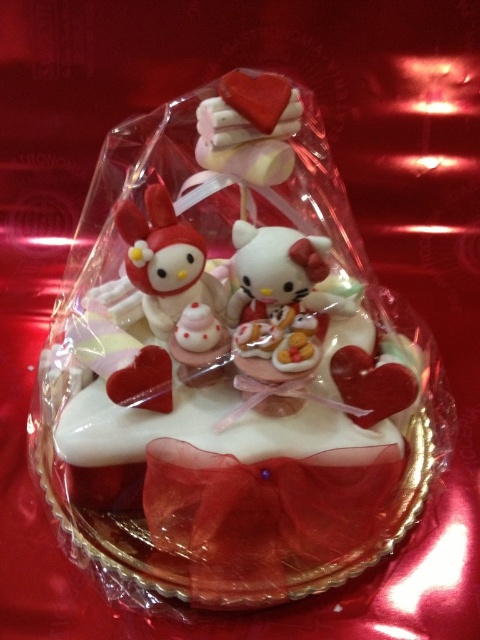
You are a baker who needs to place a small candle on the cake. Given that the white glossy cake at center is to the right of the matte plastic hello kitty at center, where should you place the candle to ensure it is centered between both objects?

The white glossy cake at center is positioned on the right side of the matte plastic hello kitty at center. To center the candle between them, place it between the two objects, closer to the matte plastic hello kitty at center to balance their positions.

You are a baker who needs to place a 6 inch wide ribbon exactly between the white glossy cake at center and the matte plastic hello kitty at center. Is there enough space between them to fit the ribbon?

The distance between the white glossy cake at center and the matte plastic hello kitty at center is 5.94 inches. Since the ribbon is 6 inches wide, it will not fit between them as the space is slightly smaller than the ribbon.

You are a photographer trying to capture the perfect shot of the white glossy cake at center. If you want to position your camera exactly at the center of the cake, where should you aim based on the coordinates provided?

You should aim your camera at the coordinates point (228, 364), as that is the 2D location of the white glossy cake at center.